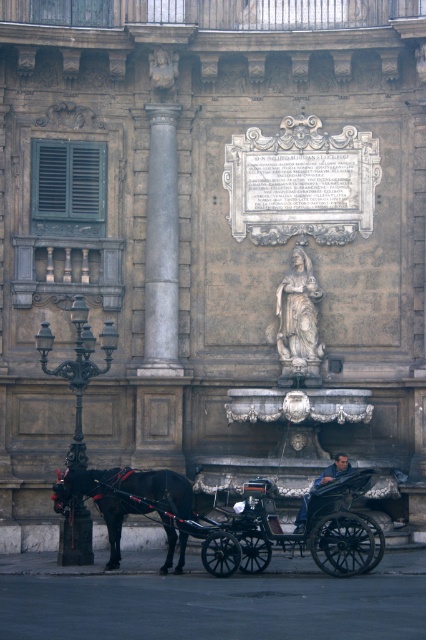
Question: Is polished stone column at center to the right of shiny black horse at left from the viewer's perspective?

Choices:
 (A) no
 (B) yes

Answer: (B)

Question: Is polished stone column at center positioned behind white marble statue at center?

Choices:
 (A) no
 (B) yes

Answer: (A)

Question: Can you confirm if polished stone column at center is positioned above white marble statue at center?

Choices:
 (A) yes
 (B) no

Answer: (A)

Question: Which object appears closest to the camera in this image?

Choices:
 (A) white marble statue at center
 (B) shiny black horse at left

Answer: (B)

Question: Which point is farther to the camera?

Choices:
 (A) polished stone column at center
 (B) white marble statue at center
 (C) blue denim jeans at lower center
 (D) shiny black horse at left

Answer: (B)

Question: Which is farther from the blue denim jeans at lower center?

Choices:
 (A) shiny black horse at left
 (B) white marble statue at center

Answer: (B)